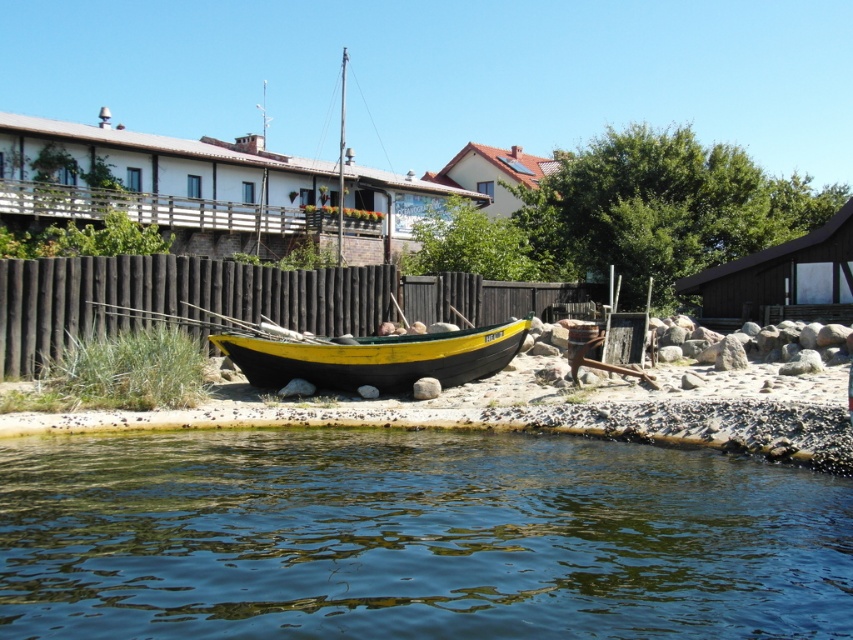
Question: Is transparent water at lower center to the right of yellow-green painted wood canoe at center from the viewer's perspective?

Choices:
 (A) no
 (B) yes

Answer: (B)

Question: Is transparent water at lower center bigger than yellow-green painted wood canoe at center?

Choices:
 (A) yes
 (B) no

Answer: (A)

Question: Does transparent water at lower center lie in front of yellow-green painted wood canoe at center?

Choices:
 (A) no
 (B) yes

Answer: (B)

Question: Which object is farther from the camera taking this photo?

Choices:
 (A) yellow-green painted wood canoe at center
 (B) transparent water at lower center

Answer: (A)